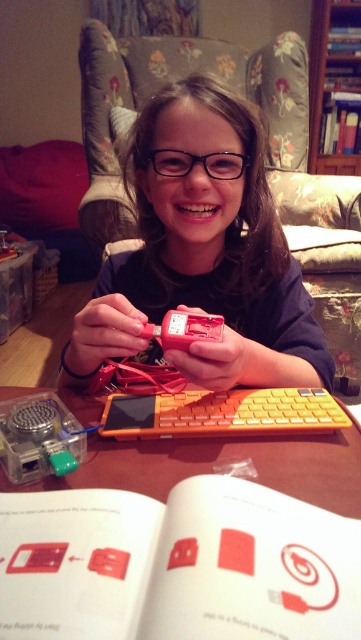
Identify the location of orange plastic keyboard at center. The image size is (361, 640). (222, 460).

Is orange plastic keyboard at center bigger than black plastic glasses at center?

Correct, orange plastic keyboard at center is larger in size than black plastic glasses at center.

Which is behind, point (122, 477) or point (225, 157)?

Point (225, 157)

Identify the location of orange plastic keyboard at center. (222, 460).

Which is in front, point (185, 452) or point (110, 394)?

Positioned in front is point (185, 452).

Image resolution: width=361 pixels, height=640 pixels. I want to click on orange plastic keyboard at center, so click(x=222, y=460).

Describe the element at coordinates (222, 460) in the screenshot. I see `orange plastic keyboard at center` at that location.

Locate an element on the screen. orange plastic keyboard at center is located at coordinates (222, 460).

Does point (228, 337) lie behind point (185, 157)?

No, (228, 337) is closer to viewer.

From the picture: Who is lower down, matte red toy at center or black plastic glasses at center?

matte red toy at center

The width and height of the screenshot is (361, 640). In order to click on matte red toy at center in this screenshot , I will do `click(202, 257)`.

I want to click on matte red toy at center, so click(x=202, y=257).